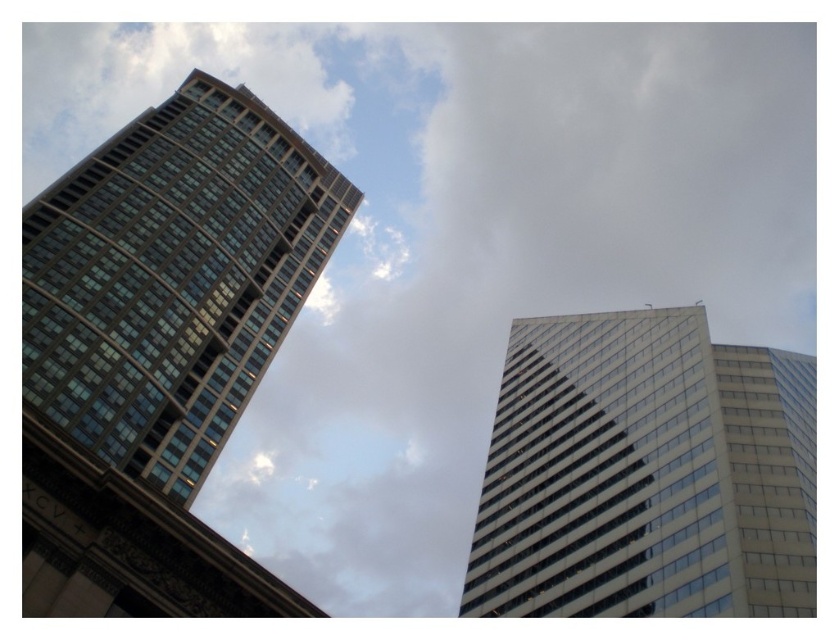
Question: Which point appears farthest from the camera in this image?

Choices:
 (A) (211, 292)
 (B) (644, 566)

Answer: (A)

Question: Which object appears farthest from the camera in this image?

Choices:
 (A) glassy reflective building at left
 (B) white glass building at upper right

Answer: (A)

Question: Can you confirm if white glass building at upper right is positioned to the left of glassy reflective building at left?

Choices:
 (A) yes
 (B) no

Answer: (B)

Question: Is white glass building at upper right thinner than glassy reflective building at left?

Choices:
 (A) no
 (B) yes

Answer: (B)

Question: Is white glass building at upper right to the right of glassy reflective building at left from the viewer's perspective?

Choices:
 (A) no
 (B) yes

Answer: (B)